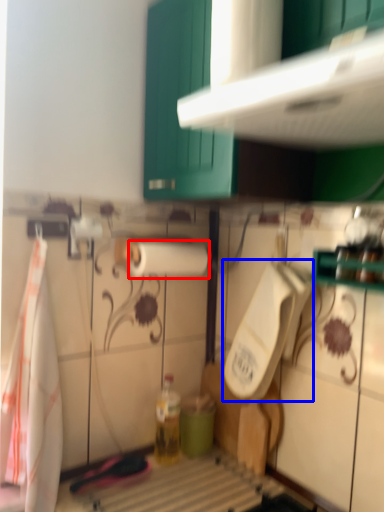
Question: Among these objects, which one is nearest to the camera, paper towel (highlighted by a red box) or urinal (highlighted by a blue box)?

Choices:
 (A) paper towel
 (B) urinal

Answer: (B)